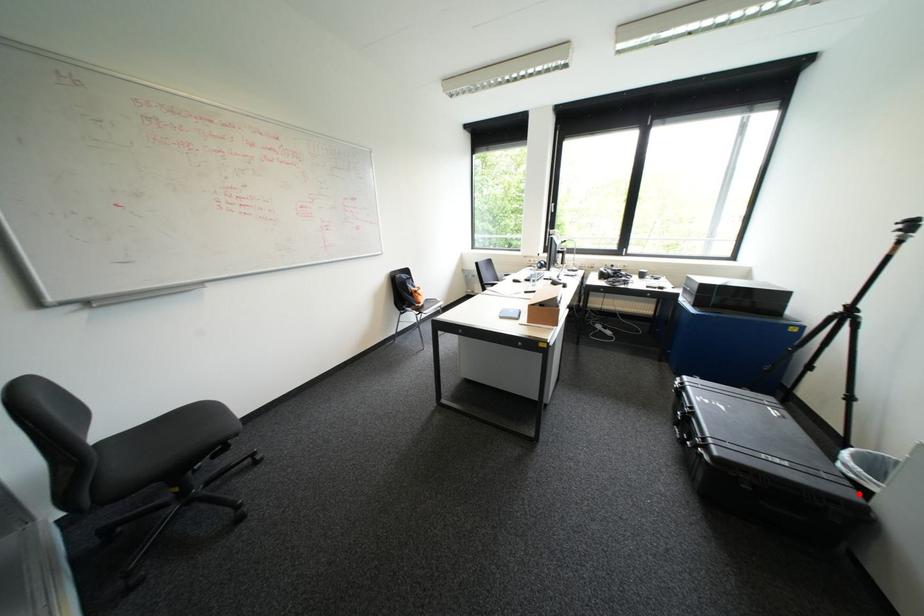
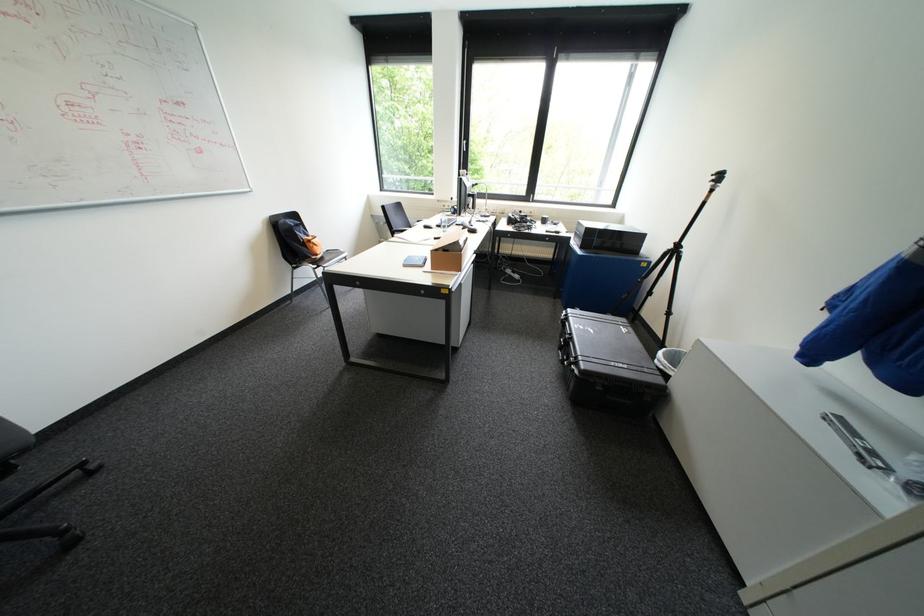
Find the pixel in the second image that matches the highlighted location in the first image.

(666, 379)